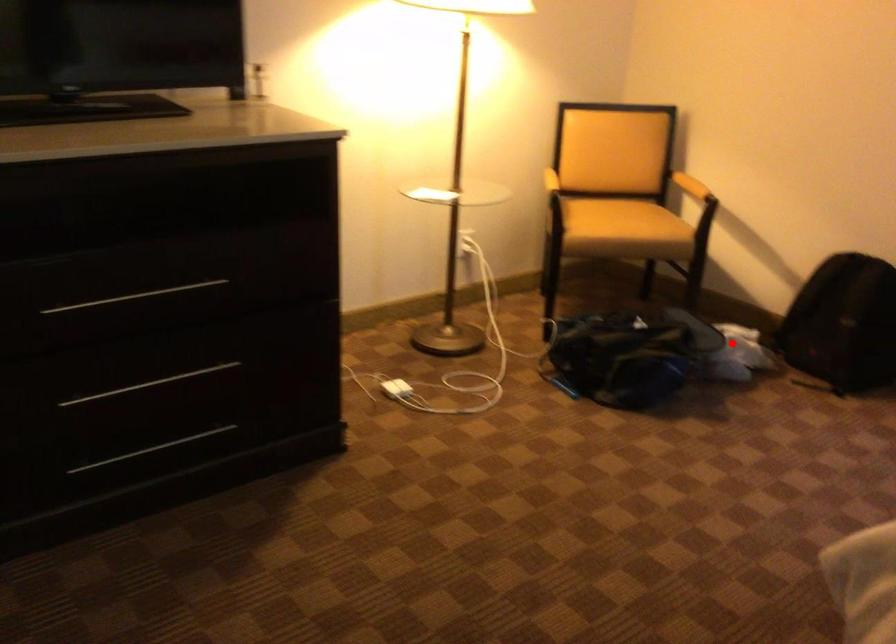
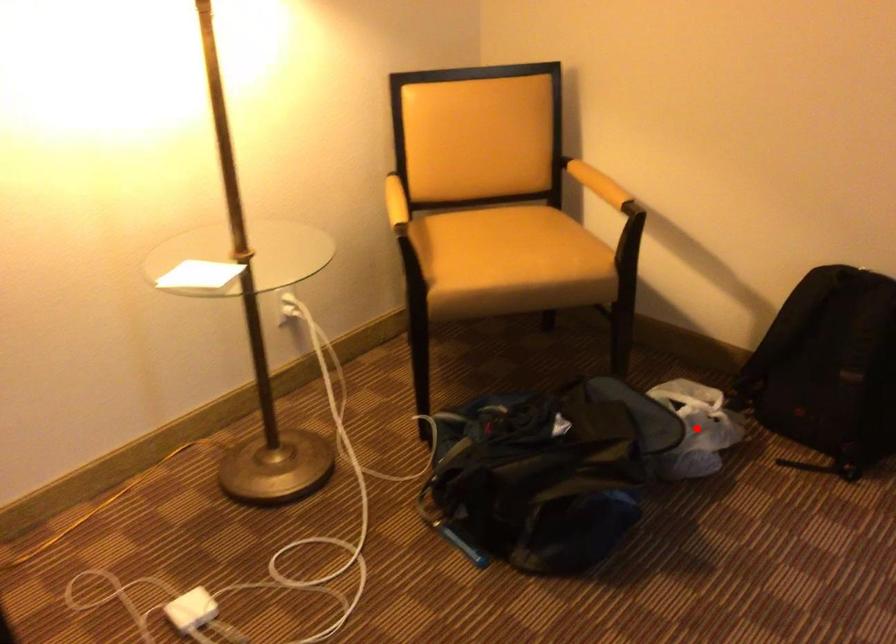
I am providing you with two images of the same scene from different viewpoints. A red point is marked on the first image and another point is marked on the second image. Do the highlighted points in image1 and image2 indicate the same real-world spot?

Yes